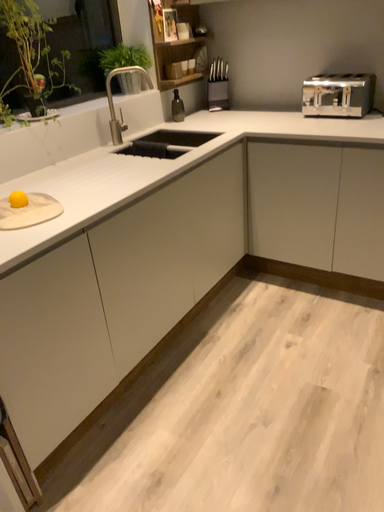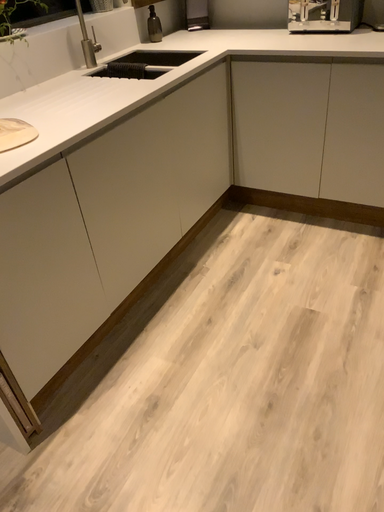
Question: Which way did the camera rotate in the video?

Choices:
 (A) rotated downward
 (B) rotated upward

Answer: (A)